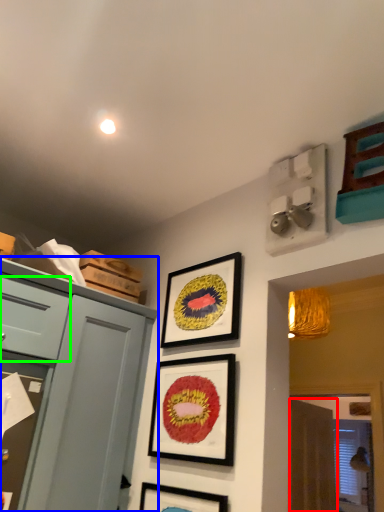
Question: Considering the real-world distances, which object is farthest from curtain (highlighted by a red box)? cabinetry (highlighted by a blue box) or drawer (highlighted by a green box)?

Choices:
 (A) cabinetry
 (B) drawer

Answer: (B)